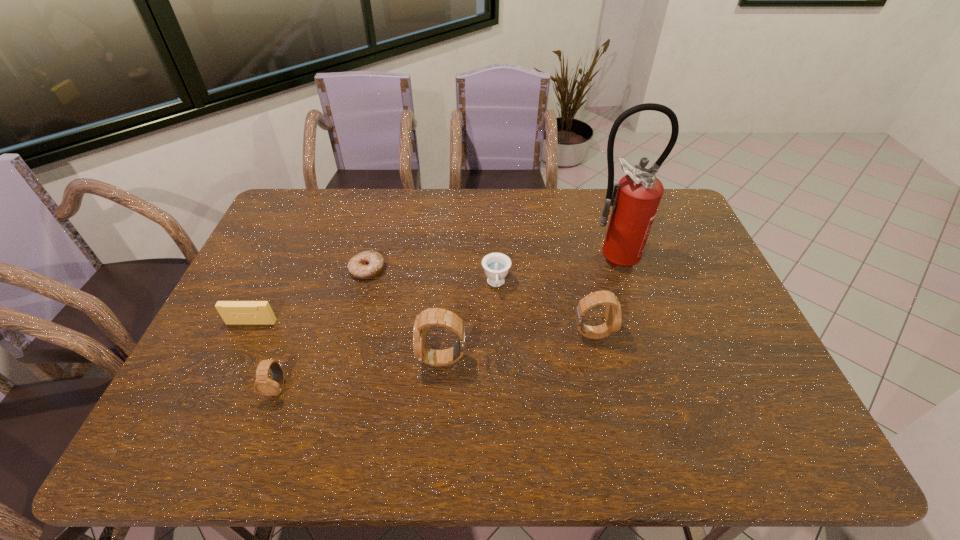
Locate an element on the screen. The width and height of the screenshot is (960, 540). vacant region at the far edge of the desktop is located at coordinates (402, 192).

Locate an element on the screen. Image resolution: width=960 pixels, height=540 pixels. vacant space at the near edge of the desktop is located at coordinates (635, 392).

The height and width of the screenshot is (540, 960). In order to click on blank space at the left edge in this screenshot , I will do `click(265, 258)`.

Image resolution: width=960 pixels, height=540 pixels. Identify the location of free space at the right edge of the desktop. [x=702, y=291].

You are a GUI agent. You are given a task and a screenshot of the screen. Output one action in this format:
    pyautogui.click(x=<x>, y=<y>)
    Task: Click on the vacant point at the near left corner
    The image size is (960, 540).
    Given the screenshot: What is the action you would take?
    pyautogui.click(x=205, y=402)

Identify the location of vacant position at the far right corner of the desktop. (664, 212).

The image size is (960, 540). Find the location of `vacant point located between the videotape and the second watch from right to left`. vacant point located between the videotape and the second watch from right to left is located at coordinates (348, 341).

You are a GUI agent. You are given a task and a screenshot of the screen. Output one action in this format:
    pyautogui.click(x=<x>, y=<y>)
    Task: Click on the free point between the leftmost object and the second watch from left to right
    
    Given the screenshot: What is the action you would take?
    pyautogui.click(x=348, y=341)

Find the location of a particular element. The image size is (960, 540). vacant space that is in between the fourth shortest object and the fourth object from left to right is located at coordinates (360, 374).

Where is `free space between the leftmost watch and the teacup`? This screenshot has width=960, height=540. free space between the leftmost watch and the teacup is located at coordinates (387, 336).